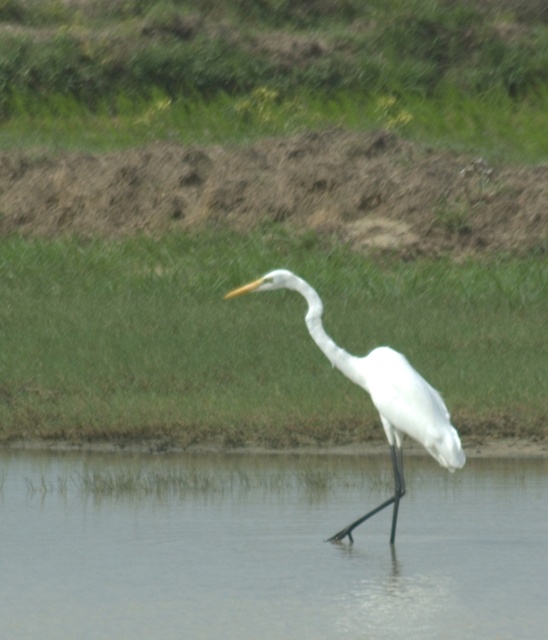
You are a photographer who wants to capture the white matte bird at center in the image. Since the clear water at center is below the bird, where should you position your camera relative to the bird to ensure the bird is fully visible above the water?

To ensure the white matte bird at center is fully visible above the clear water at center, position your camera at a higher angle than the bird so that the water remains below the bird in the frame.

You are a photographer who wants to capture the white heron in the image. To get the best shot, you need to focus on the clear water at center. What are the coordinates where you should focus your camera?

The clear water at center is located at coordinates point (269,547), so you should focus your camera there.